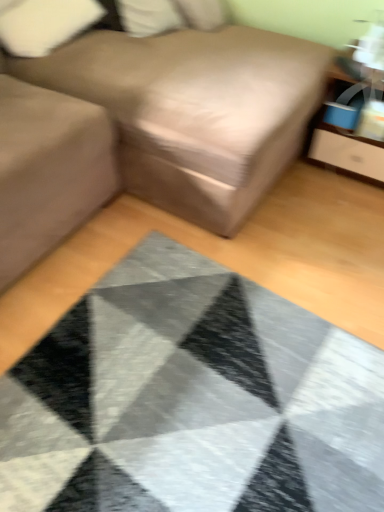
Question: Is point (67, 8) positioned closer to the camera than point (375, 151)?

Choices:
 (A) closer
 (B) farther

Answer: (B)

Question: Is white fabric pillow at upper left, the first pillow in the left-to-right sequence, inside or outside of matte wood dresser at upper right?

Choices:
 (A) outside
 (B) inside

Answer: (A)

Question: Considering the real-world distances, which object is closest to the matte gray sofa at left?

Choices:
 (A) matte wood dresser at upper right
 (B) textured gray mat at center
 (C) white soft pillow at upper center, positioned as the 2th pillow in left-to-right order
 (D) white fabric pillow at upper left, the first pillow in the left-to-right sequence
 (E) brown fabric couch at center

Answer: (E)

Question: Which object is positioned closest to the brown fabric couch at center?

Choices:
 (A) white soft pillow at upper center, the first pillow in the right-to-left sequence
 (B) matte wood dresser at upper right
 (C) textured gray mat at center
 (D) matte gray sofa at left
 (E) white fabric pillow at upper left, placed as the second pillow when sorted from right to left

Answer: (D)